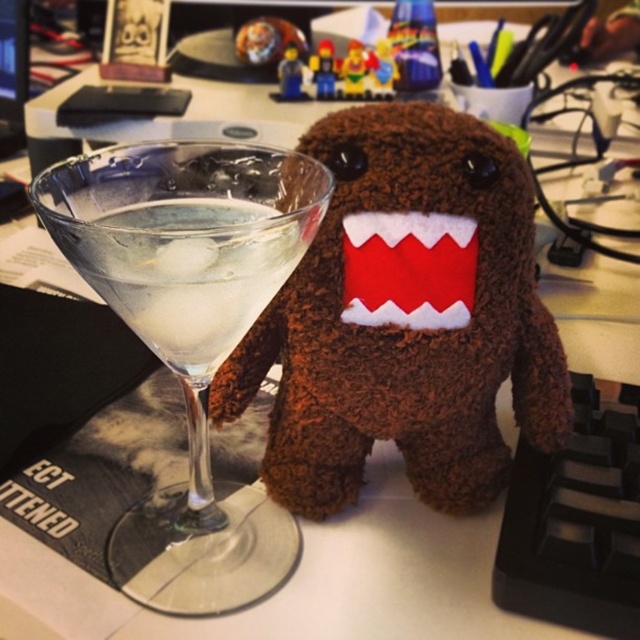
Is smooth plastic toy at center thinner than matte plastic lego minifigure at center?

Incorrect, smooth plastic toy at center's width is not less than matte plastic lego minifigure at center's.

From the picture: Is smooth plastic toy at center to the left of matte plastic lego minifigure at center from the viewer's perspective?

Incorrect, smooth plastic toy at center is not on the left side of matte plastic lego minifigure at center.

Does point (344, 77) come in front of point (333, 60)?

Yes, point (344, 77) is closer to viewer.

The height and width of the screenshot is (640, 640). What are the coordinates of `smooth plastic toy at center` in the screenshot? It's located at (356, 68).

Is clear glass ice at left to the right of smooth plastic toy at center from the viewer's perspective?

Incorrect, clear glass ice at left is not on the right side of smooth plastic toy at center.

Is clear glass ice at left wider than smooth plastic toy at center?

Yes.

The image size is (640, 640). What are the coordinates of `clear glass ice at left` in the screenshot? It's located at (188, 273).

Does black plastic keyboard at lower right have a lesser height compared to smooth plastic minifigure at center?

No, black plastic keyboard at lower right is not shorter than smooth plastic minifigure at center.

The image size is (640, 640). I want to click on black plastic keyboard at lower right, so click(x=576, y=524).

Find the location of a particular element. black plastic keyboard at lower right is located at coordinates (576, 524).